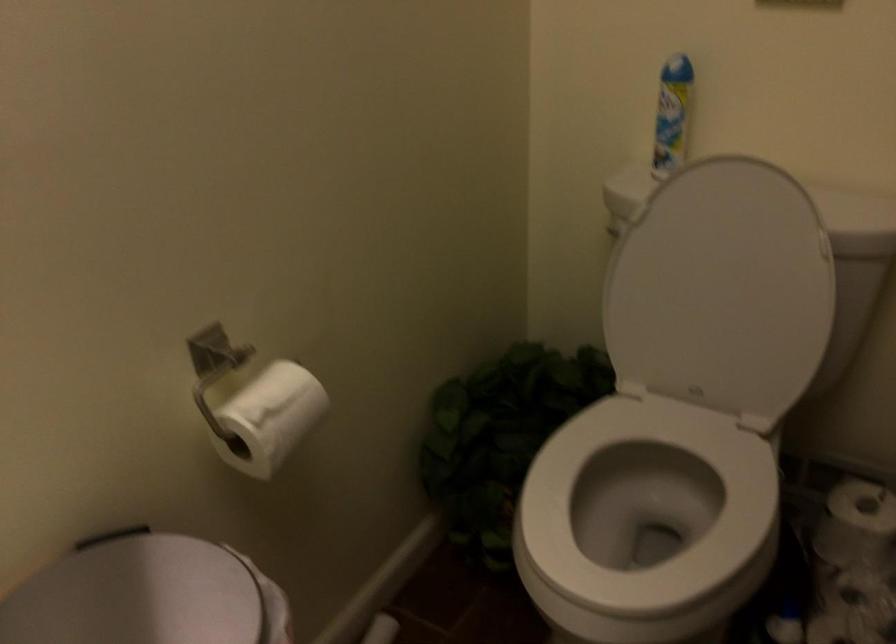
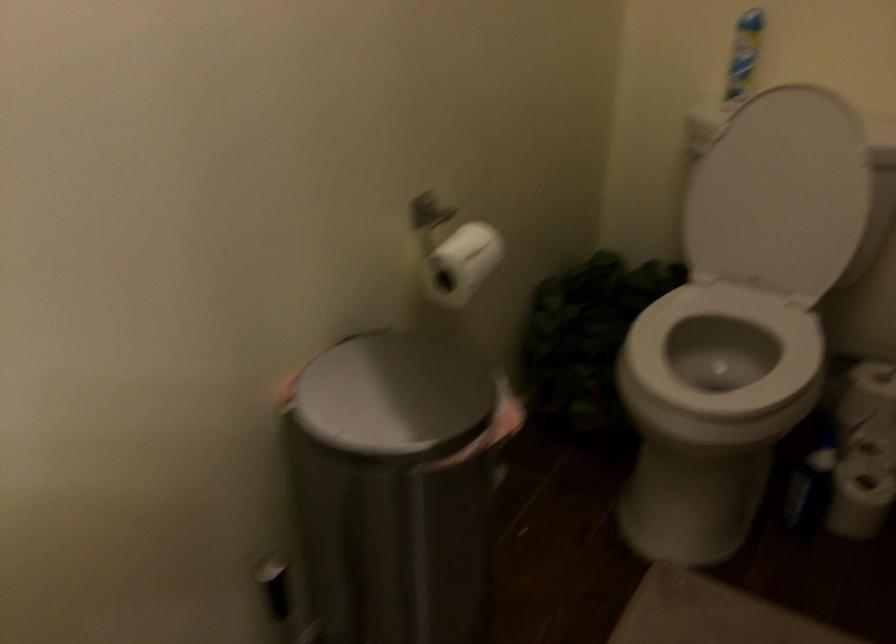
Question: The camera is either moving clockwise (left) or counter-clockwise (right) around the object. The first image is from the beginning of the video and the second image is from the end. Is the camera moving left or right when shooting the video?

Choices:
 (A) Left
 (B) Right

Answer: (A)